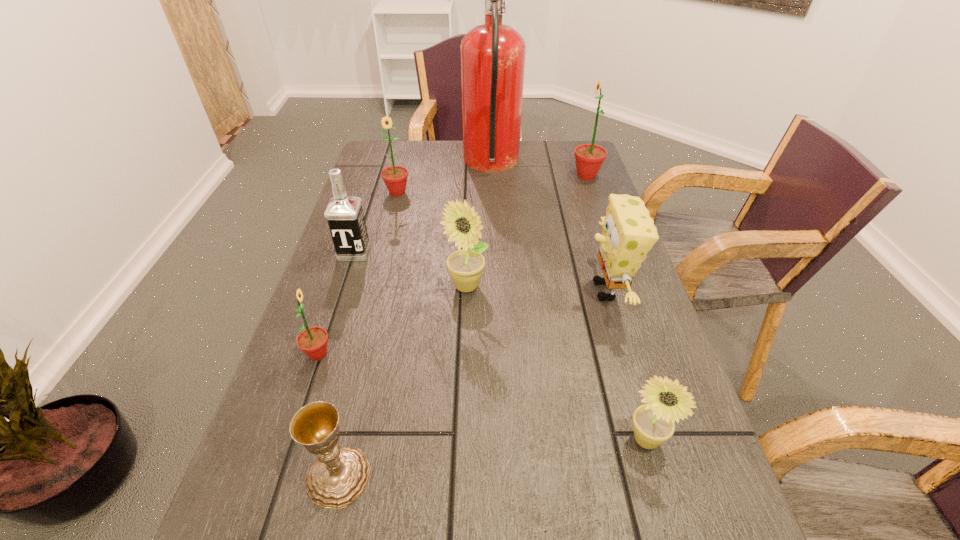
The image size is (960, 540). What are the coordinates of `the smallest green sunflower` in the screenshot? It's located at (312, 341).

Find the location of a particular element. This screenshot has width=960, height=540. the second nearest sunflower is located at coordinates (312, 341).

Locate an element on the screen. This screenshot has height=540, width=960. the nearer yellow sunflower is located at coordinates (653, 423).

Locate an element on the screen. The image size is (960, 540). the smaller yellow sunflower is located at coordinates (653, 423).

Where is `gold chalice`? gold chalice is located at coordinates (340, 475).

Identify the location of free spot located 0.170m with the handle and nozzle on the tallest object. The image size is (960, 540). (411, 165).

Find the location of a particular element. This screenshot has width=960, height=540. vacant position located 0.100m with the handle and nozzle on the tallest object is located at coordinates (432, 165).

I want to click on vacant space located with the handle and nozzle on the tallest object, so click(x=405, y=165).

The height and width of the screenshot is (540, 960). I want to click on free region located 0.160m on the face of the biggest green sunflower, so click(520, 176).

Image resolution: width=960 pixels, height=540 pixels. What are the coordinates of `blank area located on the face of the biggest green sunflower` in the screenshot? It's located at (454, 176).